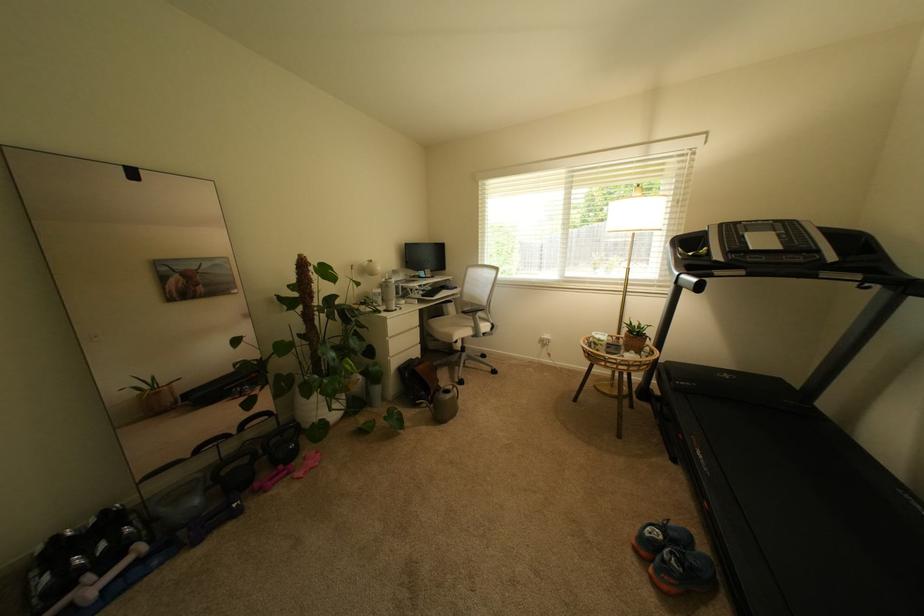
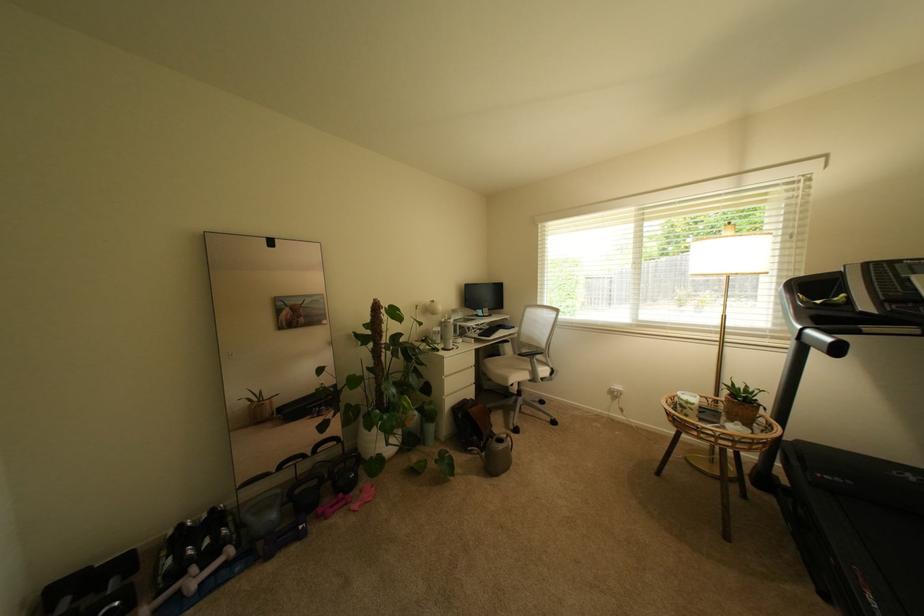
In the second image, find the point that corresponds to point 399,354 in the first image.

(455, 392)